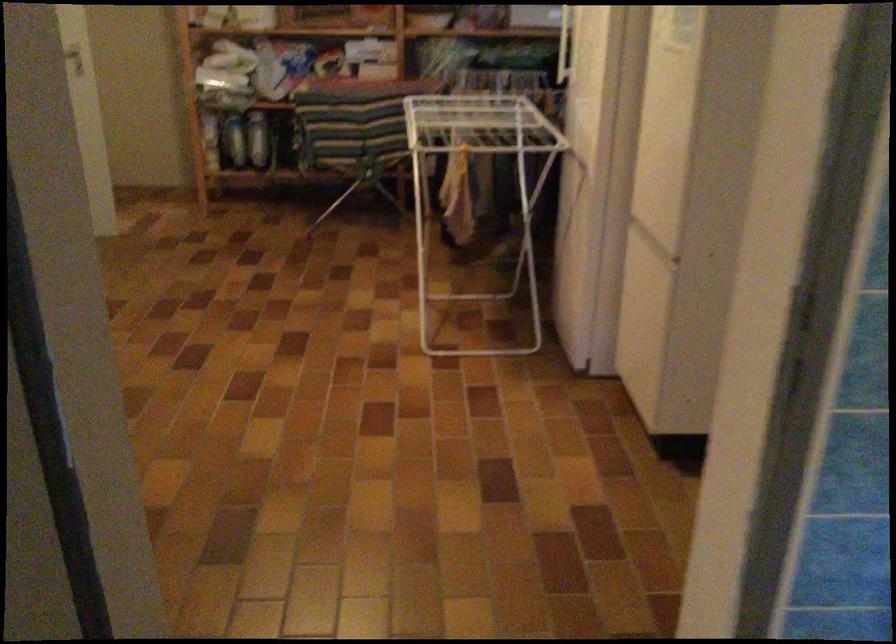
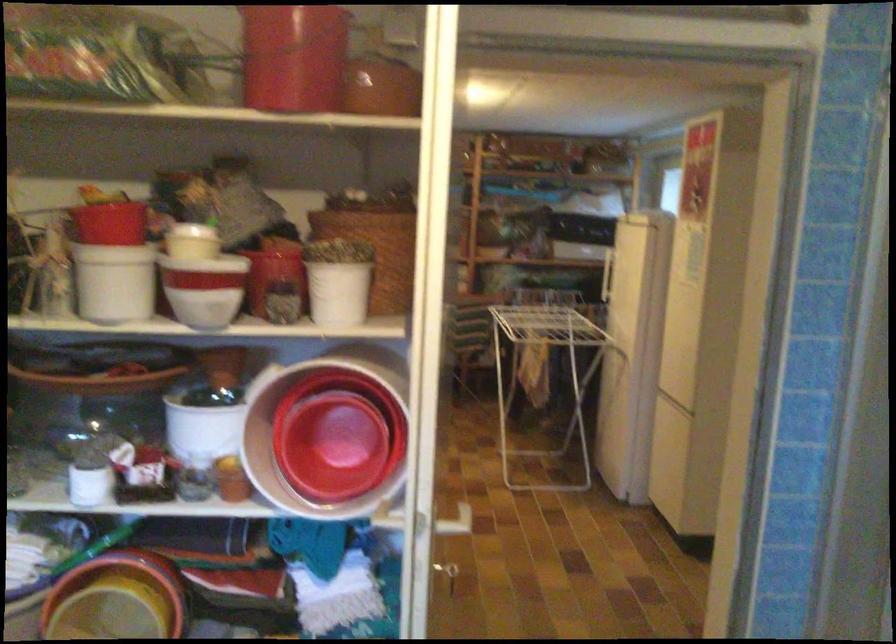
Locate, in the second image, the point that corresponds to point (312, 518) in the first image.

(449, 574)